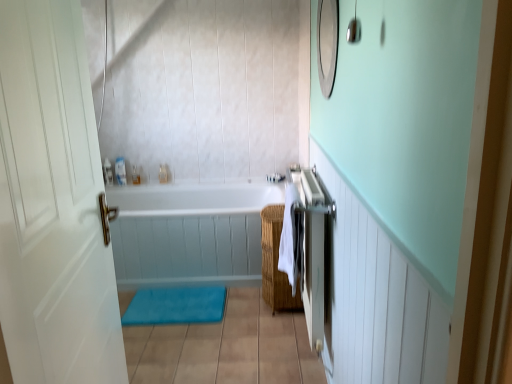
At what (x,y) coordinates should I click in order to perform the action: click on vacant area in front of woven brown basket at center. Please return your answer as a coordinate pair (x, y). Image resolution: width=512 pixels, height=384 pixels. Looking at the image, I should click on (267, 320).